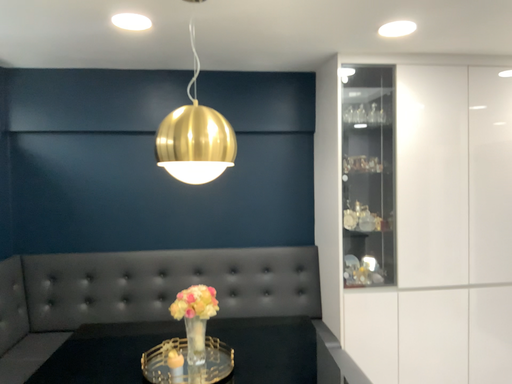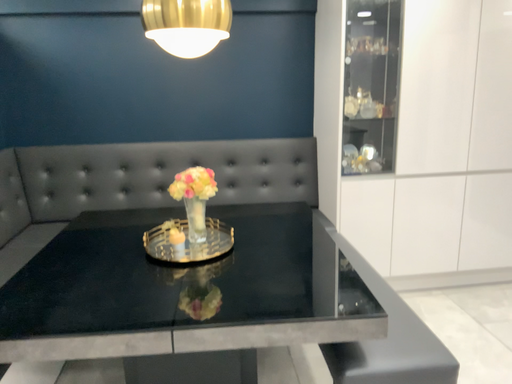
Question: How did the camera likely rotate when shooting the video?

Choices:
 (A) rotated downward
 (B) rotated upward

Answer: (A)